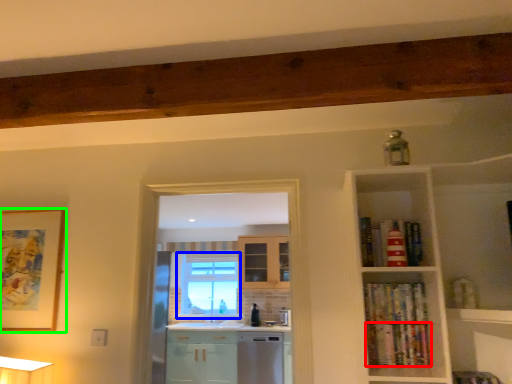
Question: Which object is positioned farthest from book (highlighted by a red box)? Select from window (highlighted by a blue box) and picture frame (highlighted by a green box).

Choices:
 (A) window
 (B) picture frame

Answer: (A)